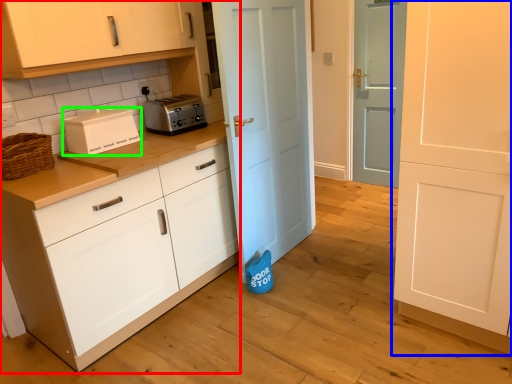
Question: Considering the real-world distances, which object is closest to cabinetry (highlighted by a red box)? door (highlighted by a blue box) or home appliance (highlighted by a green box).

Choices:
 (A) door
 (B) home appliance

Answer: (B)